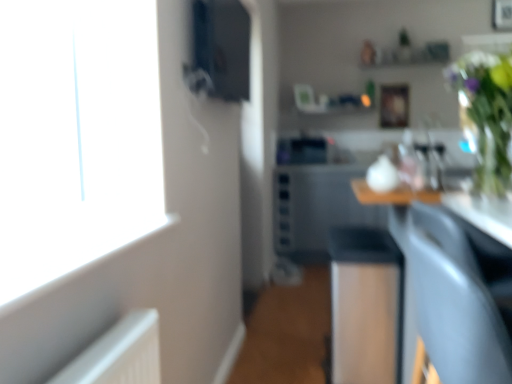
Question: Does wooden picture frame at upper center have a greater width compared to matte black speaker at upper center?

Choices:
 (A) no
 (B) yes

Answer: (A)

Question: From the image's perspective, would you say wooden picture frame at upper center is positioned over matte black speaker at upper center?

Choices:
 (A) no
 (B) yes

Answer: (B)

Question: Is wooden picture frame at upper center touching matte black speaker at upper center?

Choices:
 (A) no
 (B) yes

Answer: (A)

Question: Is matte black speaker at upper center surrounded by wooden picture frame at upper center?

Choices:
 (A) no
 (B) yes

Answer: (A)

Question: Does wooden picture frame at upper center have a lesser width compared to matte black speaker at upper center?

Choices:
 (A) no
 (B) yes

Answer: (B)

Question: In terms of size, does matte gray armchair at lower right appear bigger or smaller than black glossy sink at center?

Choices:
 (A) small
 (B) big

Answer: (B)

Question: From the image's perspective, is matte gray armchair at lower right above or below black glossy sink at center?

Choices:
 (A) below
 (B) above

Answer: (A)

Question: From a real-world perspective, is matte gray armchair at lower right positioned above or below black glossy sink at center?

Choices:
 (A) above
 (B) below

Answer: (B)

Question: Looking at their shapes, would you say matte gray armchair at lower right is wider or thinner than black glossy sink at center?

Choices:
 (A) thin
 (B) wide

Answer: (B)

Question: Considering the positions of wooden picture frame at upper center and black glossy dishwasher at center in the image, is wooden picture frame at upper center wider or thinner than black glossy dishwasher at center?

Choices:
 (A) wide
 (B) thin

Answer: (B)

Question: From a real-world perspective, is wooden picture frame at upper center physically located above or below black glossy dishwasher at center?

Choices:
 (A) above
 (B) below

Answer: (A)

Question: From the image's perspective, is wooden picture frame at upper center above or below black glossy dishwasher at center?

Choices:
 (A) above
 (B) below

Answer: (A)

Question: In terms of height, does wooden picture frame at upper center look taller or shorter compared to black glossy dishwasher at center?

Choices:
 (A) short
 (B) tall

Answer: (A)

Question: From a real-world perspective, is black glossy sink at center physically located above or below wooden picture frame at upper center?

Choices:
 (A) above
 (B) below

Answer: (B)

Question: Does point (349, 157) appear closer or farther from the camera than point (403, 109)?

Choices:
 (A) farther
 (B) closer

Answer: (A)